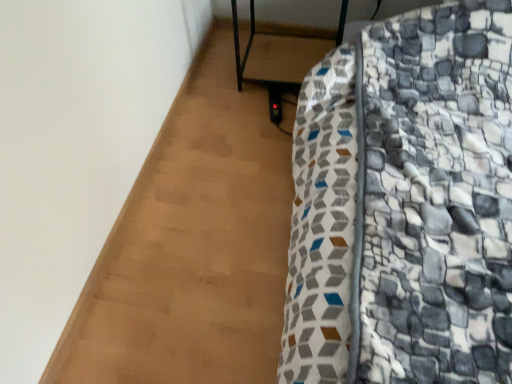
Question: From their relative heights in the image, would you say metallic black side table at center, the 1th furniture from the top, is taller or shorter than patterned fabric bed at lower right, the 2th furniture when ordered from top to bottom?

Choices:
 (A) short
 (B) tall

Answer: (A)

Question: From a real-world perspective, is metallic black side table at center, the 1th furniture from the top, physically located above or below patterned fabric bed at lower right, the 2th furniture when ordered from top to bottom?

Choices:
 (A) above
 (B) below

Answer: (B)

Question: Looking at the image, does metallic black side table at center, the second furniture positioned from the bottom, seem bigger or smaller compared to patterned fabric bed at lower right, arranged as the 1th furniture when ordered from the bottom?

Choices:
 (A) big
 (B) small

Answer: (B)

Question: Is patterned fabric bed at lower right, the 2th furniture when ordered from top to bottom, situated inside metallic black side table at center, the 1th furniture from the top, or outside?

Choices:
 (A) outside
 (B) inside

Answer: (A)

Question: In terms of width, does patterned fabric bed at lower right, the 2th furniture when ordered from top to bottom, look wider or thinner when compared to metallic black side table at center, the second furniture positioned from the bottom?

Choices:
 (A) thin
 (B) wide

Answer: (B)

Question: From a real-world perspective, is patterned fabric bed at lower right, the 2th furniture when ordered from top to bottom, above or below metallic black side table at center, the 1th furniture from the top?

Choices:
 (A) below
 (B) above

Answer: (B)

Question: In the image, is patterned fabric bed at lower right, the 2th furniture when ordered from top to bottom, positioned in front of or behind metallic black side table at center, the 1th furniture from the top?

Choices:
 (A) front
 (B) behind

Answer: (A)